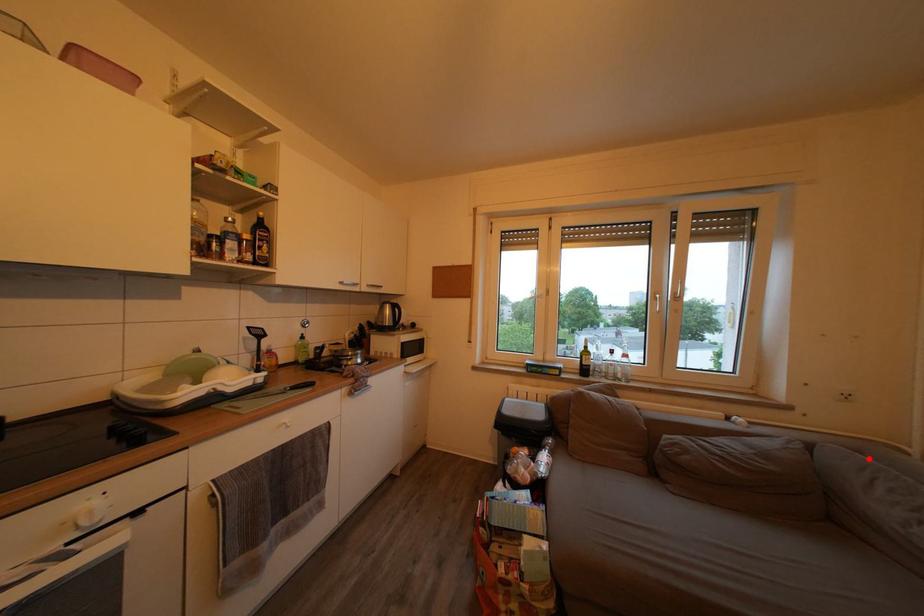
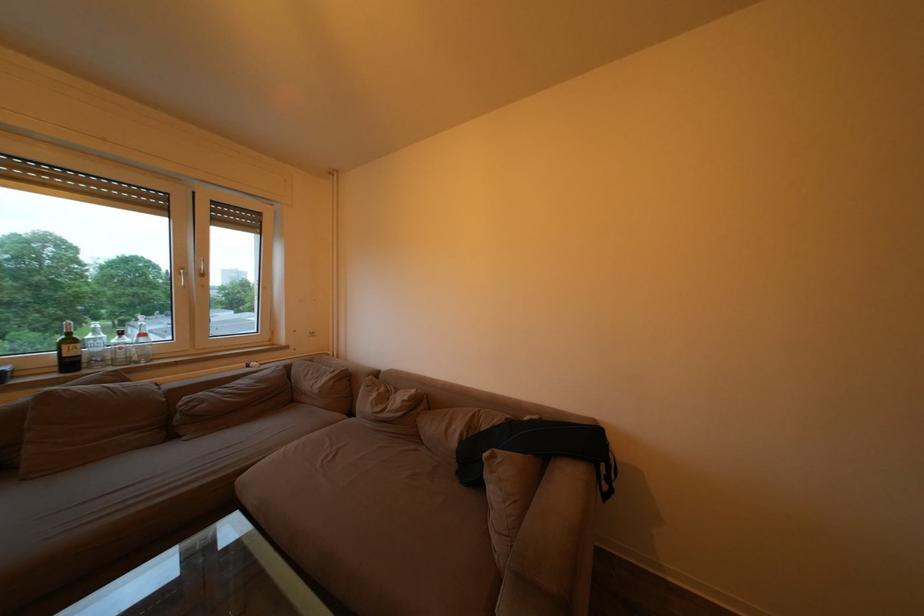
Where in the second image is the point corresponding to the highlighted location from the first image?

(319, 367)